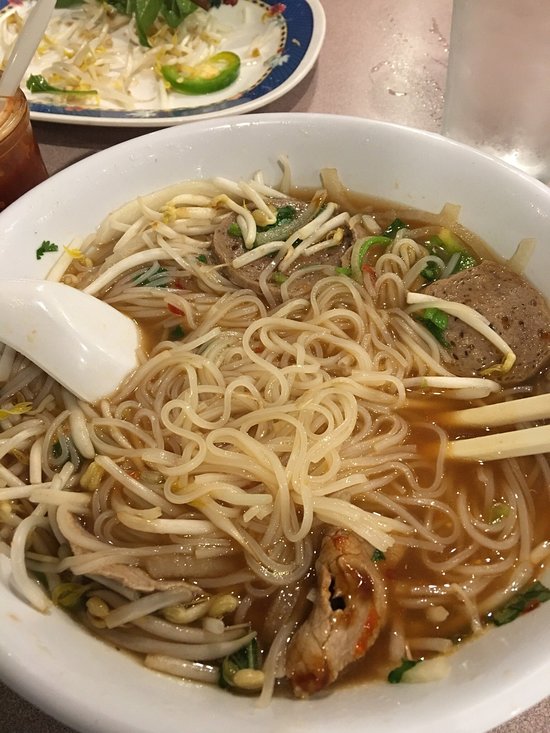
The width and height of the screenshot is (550, 733). I want to click on table top, so click(425, 67).